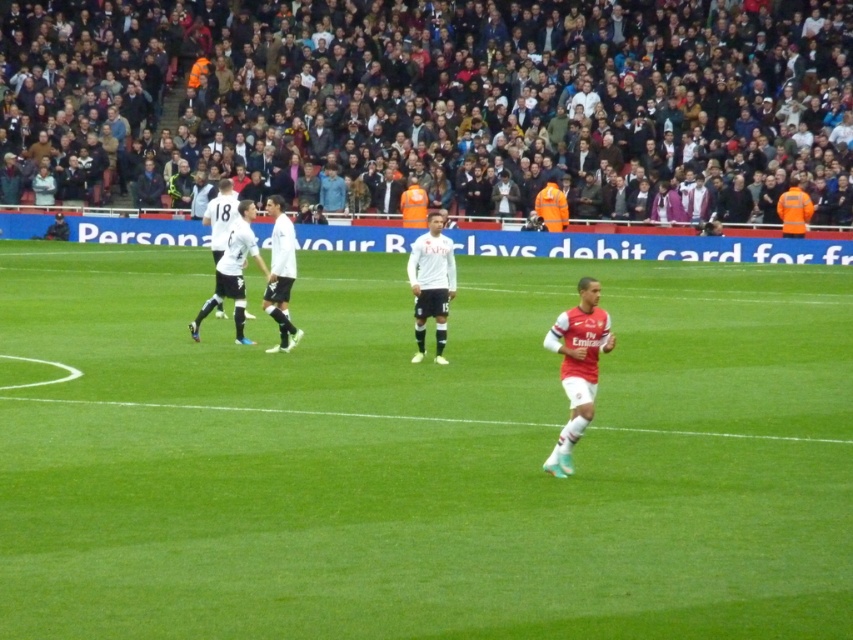
Is matte red jersey at right thinner than white smooth jersey at center?

Incorrect, matte red jersey at right's width is not less than white smooth jersey at center's.

You are a GUI agent. You are given a task and a screenshot of the screen. Output one action in this format:
    pyautogui.click(x=<x>, y=<y>)
    Task: Click on the matte red jersey at right
    The image size is (853, 640).
    Given the screenshot: What is the action you would take?
    pyautogui.click(x=577, y=365)

I want to click on matte red jersey at right, so click(x=577, y=365).

Can you confirm if dark gray crowd at upper center is positioned above white matte jersey at center?

Indeed, dark gray crowd at upper center is positioned over white matte jersey at center.

Find the location of a particular element. dark gray crowd at upper center is located at coordinates (434, 100).

Is white matte jersey at center above white smooth jersey at center?

Indeed, white matte jersey at center is positioned over white smooth jersey at center.

Is white matte jersey at center to the right of white smooth jersey at center from the viewer's perspective?

In fact, white matte jersey at center is to the left of white smooth jersey at center.

Who is more distant from viewer, (241, 301) or (288, 276)?

Positioned behind is point (241, 301).

Locate an element on the screen. This screenshot has width=853, height=640. white matte jersey at center is located at coordinates (233, 272).